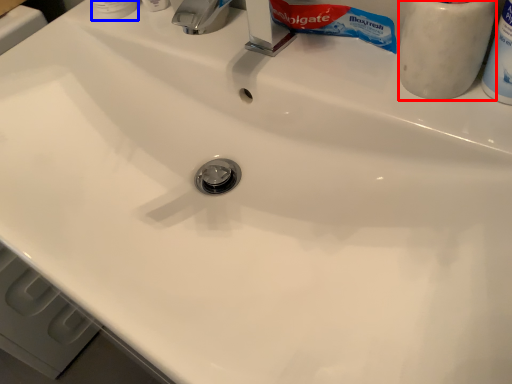
Question: Which point is closer to the camera, toiletry (highlighted by a red box) or toiletry (highlighted by a blue box)?

Choices:
 (A) toiletry
 (B) toiletry

Answer: (A)